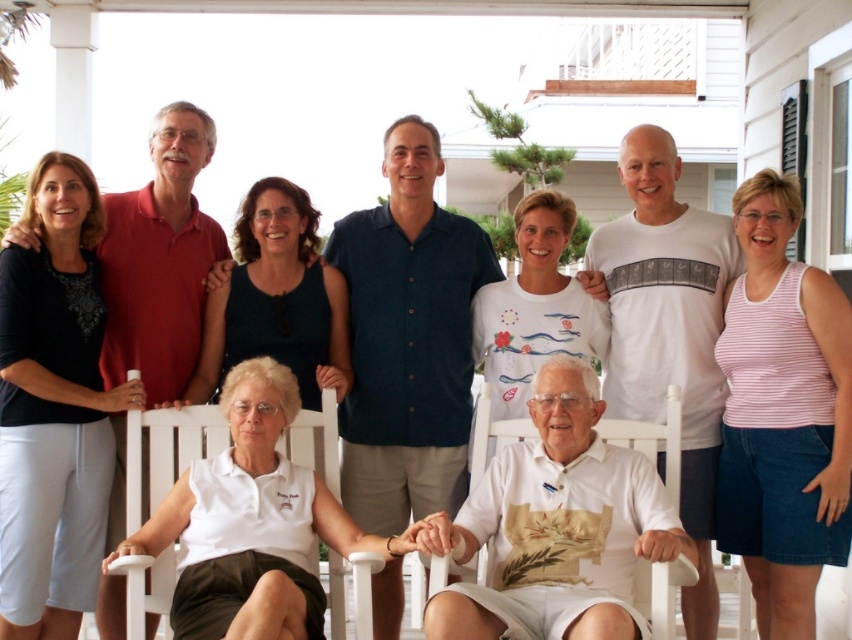
You are planning to seat a group of people for a photo. You have two chairs available in the scene, the white wood chair at lower center and the white plastic chair at center. Which chair would be more comfortable for someone who prefers a spacious seating option?

The white wood chair at lower center is larger in size compared to the white plastic chair at center, making it more comfortable for someone who prefers a spacious seating option.

You are standing at the back of the scene and want to sit down. There are two chairs available, the white wood chair at lower center and the white plastic chair at center. Which chair is closer to you?

The white plastic chair at center is closer to you because the white wood chair at lower center is located below it, meaning it is further away.